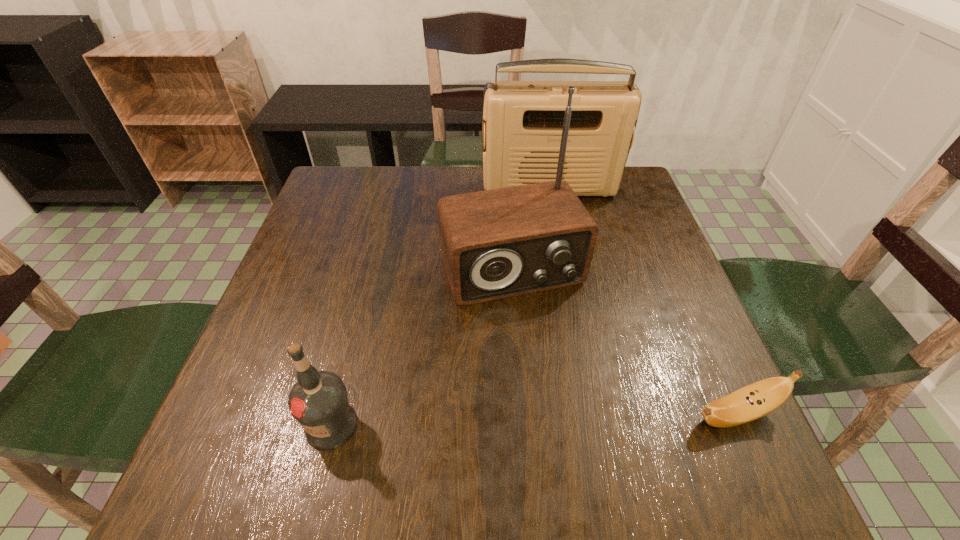
At what (x,y) coordinates should I click in order to perform the action: click on free space on the desktop that is between the vodka and the banana and is positioned on the front-facing side of the nearer radio receiver. Please return your answer as a coordinate pair (x, y). Looking at the image, I should click on (576, 418).

You are a GUI agent. You are given a task and a screenshot of the screen. Output one action in this format:
    pyautogui.click(x=<x>, y=<y>)
    Task: Click on the free spot on the desktop that is between the vodka and the banana and is positioned on the front-facing side of the farther radio receiver
    
    Given the screenshot: What is the action you would take?
    pyautogui.click(x=595, y=418)